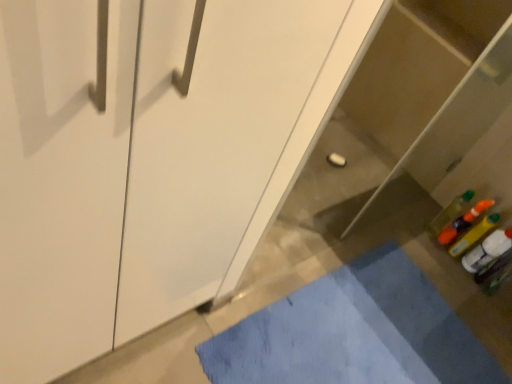
Question: Can you confirm if white glossy cabinet at center is shorter than blue fabric bath mat at lower center?

Choices:
 (A) yes
 (B) no

Answer: (B)

Question: From a real-world perspective, is white glossy cabinet at center located beneath blue fabric bath mat at lower center?

Choices:
 (A) no
 (B) yes

Answer: (A)

Question: From the image's perspective, would you say white glossy cabinet at center is shown under blue fabric bath mat at lower center?

Choices:
 (A) no
 (B) yes

Answer: (A)

Question: Is the depth of white glossy cabinet at center greater than that of blue fabric bath mat at lower center?

Choices:
 (A) yes
 (B) no

Answer: (B)

Question: Is white glossy cabinet at center closer to camera compared to blue fabric bath mat at lower center?

Choices:
 (A) yes
 (B) no

Answer: (A)

Question: Is blue fabric bath mat at lower center wider or thinner than white glossy cabinet at center?

Choices:
 (A) wide
 (B) thin

Answer: (A)

Question: Is blue fabric bath mat at lower center bigger or smaller than white glossy cabinet at center?

Choices:
 (A) small
 (B) big

Answer: (A)

Question: From the image's perspective, is blue fabric bath mat at lower center located above or below white glossy cabinet at center?

Choices:
 (A) below
 (B) above

Answer: (A)

Question: Is point (243, 324) positioned closer to the camera than point (209, 134)?

Choices:
 (A) closer
 (B) farther

Answer: (B)

Question: Is point (437, 218) closer or farther from the camera than point (237, 28)?

Choices:
 (A) closer
 (B) farther

Answer: (B)

Question: Is translucent plastic bottle at lower right taller or shorter than white glossy cabinet at center?

Choices:
 (A) tall
 (B) short

Answer: (B)

Question: In the image, is translucent plastic bottle at lower right on the left side or the right side of white glossy cabinet at center?

Choices:
 (A) right
 (B) left

Answer: (A)

Question: Do you think translucent plastic bottle at lower right is within white glossy cabinet at center, or outside of it?

Choices:
 (A) outside
 (B) inside

Answer: (A)

Question: From the image's perspective, is blue fabric bath mat at lower center located above or below translucent plastic bottle at lower right?

Choices:
 (A) above
 (B) below

Answer: (B)

Question: Is point (x=237, y=332) positioned closer to the camera than point (x=472, y=190)?

Choices:
 (A) closer
 (B) farther

Answer: (A)